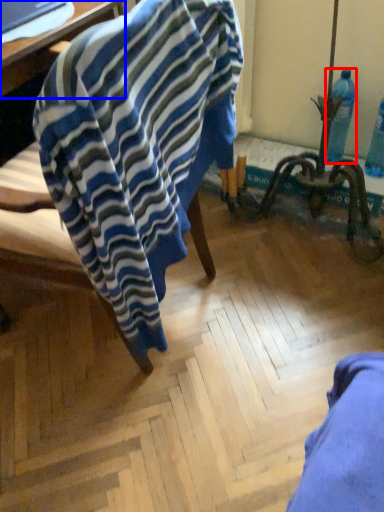
Question: Which object is further to the camera taking this photo, bottle (highlighted by a red box) or table (highlighted by a blue box)?

Choices:
 (A) bottle
 (B) table

Answer: (A)